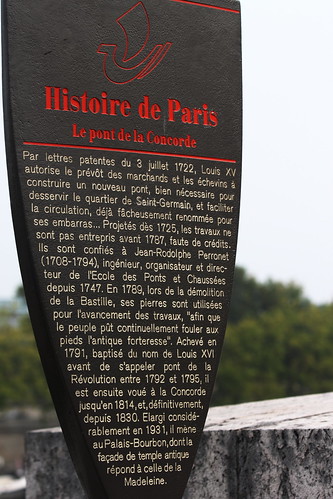
The image size is (333, 499). I want to click on top of wall, so click(279, 417).